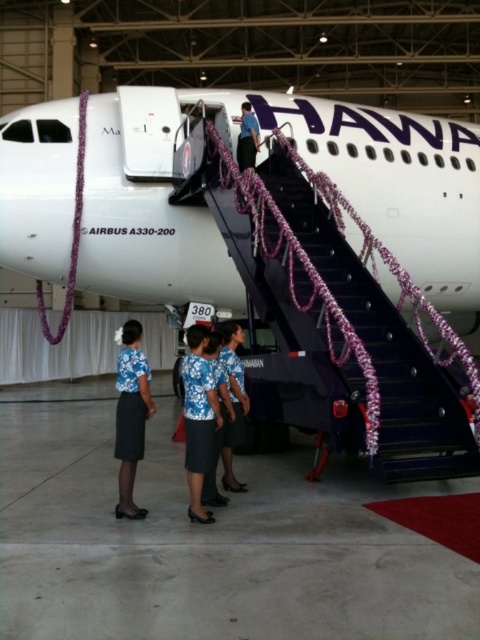
Is white glossy airplane at center further to camera compared to floral fabric dress at center?

Yes, it is behind floral fabric dress at center.

Does white glossy airplane at center appear on the left side of floral fabric dress at center?

Incorrect, white glossy airplane at center is not on the left side of floral fabric dress at center.

Where is `white glossy airplane at center`? This screenshot has width=480, height=640. white glossy airplane at center is located at coordinates (308, 168).

Is white glossy airplane at center smaller than blue fabric shirt at center?

Actually, white glossy airplane at center might be larger than blue fabric shirt at center.

This screenshot has height=640, width=480. I want to click on white glossy airplane at center, so click(308, 168).

You are a GUI agent. You are given a task and a screenshot of the screen. Output one action in this format:
    pyautogui.click(x=<x>, y=<y>)
    Task: Click on the white glossy airplane at center
    
    Given the screenshot: What is the action you would take?
    pyautogui.click(x=308, y=168)

Is point (278, 458) more distant than point (243, 157)?

No, it is not.

Between gray concrete tarmac at lower center and blue fabric shirt at center, which one appears on the left side from the viewer's perspective?

blue fabric shirt at center is more to the left.

Is point (251, 497) positioned after point (254, 144)?

No.

Identify the location of gray concrete tarmac at lower center. This screenshot has width=480, height=640. (205, 540).